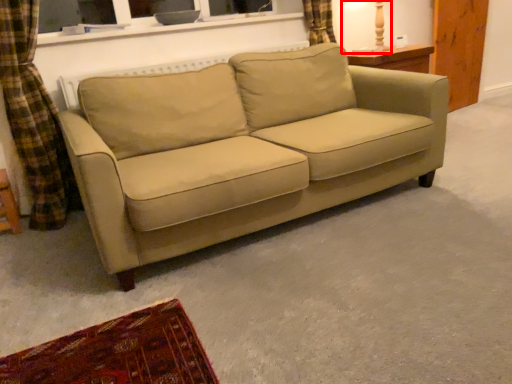
Question: In this image, where is table lamp (annotated by the red box) located relative to studio couch?

Choices:
 (A) left
 (B) right

Answer: (B)